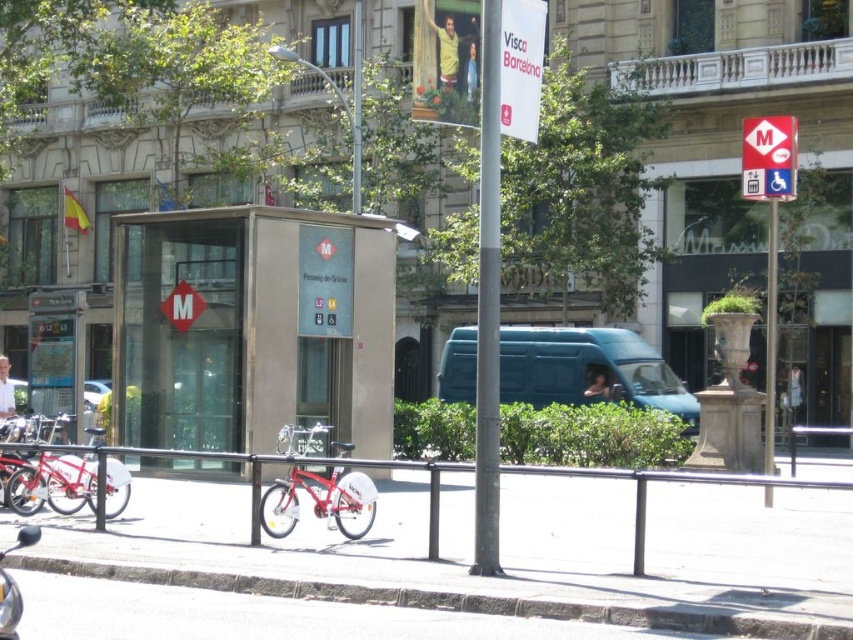
You are a delivery person with a package that needs to be placed on the white concrete pavement at center. The shiny red bicycle at center is currently blocking the area. Can you move the bicycle to access the pavement? Please consider the distance between them.

The distance between the white concrete pavement at center and the shiny red bicycle at center is 10.80 feet. Since the bicycle is parked 10.80 feet away from the pavement, it is not blocking the area. You can access the pavement without moving the bicycle.

You are a pedestrian standing on the sidewalk in Barcelona. You see a white cotton shirt at lower left and a metallic silver car at center. Which object is closer to the ground?

The metallic silver car at center is closer to the ground because the white cotton shirt at lower left is located above it.